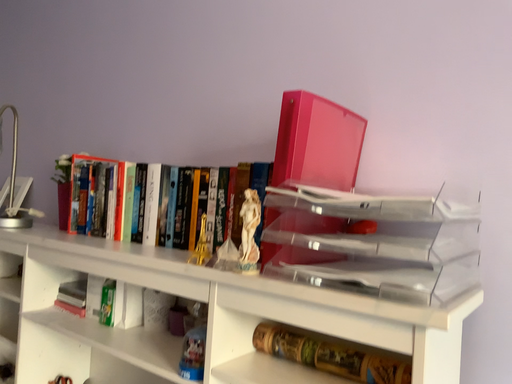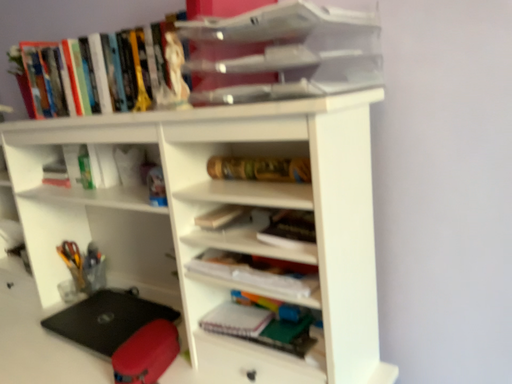
Question: Which way did the camera rotate in the video?

Choices:
 (A) rotated downward
 (B) rotated upward

Answer: (A)